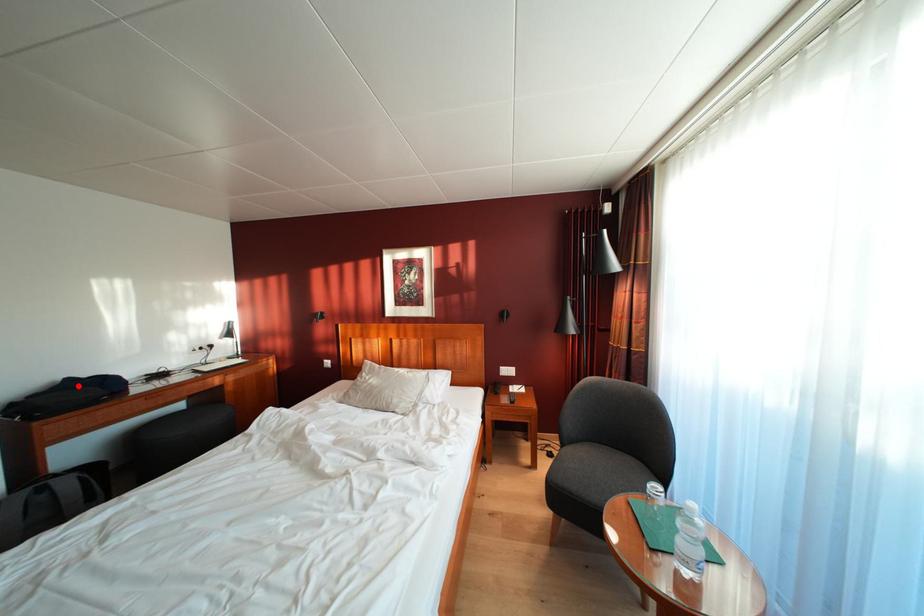
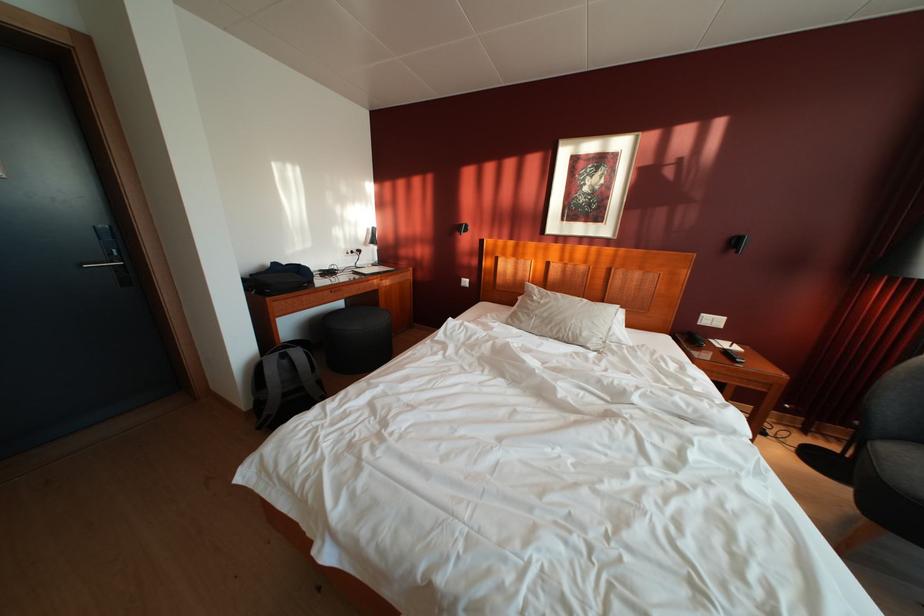
Where in the second image is the point corresponding to the highlighted location from the first image?

(284, 270)